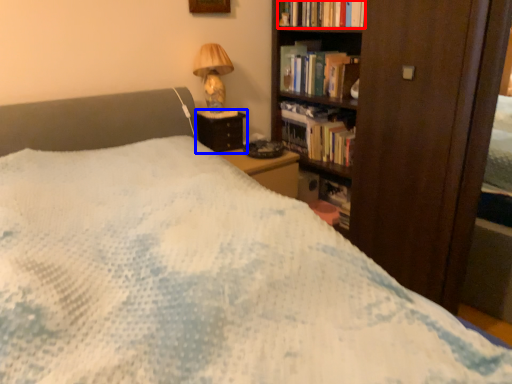
Question: Which of the following is the farthest to the observer, book (highlighted by a red box) or nightstand (highlighted by a blue box)?

Choices:
 (A) book
 (B) nightstand

Answer: (B)